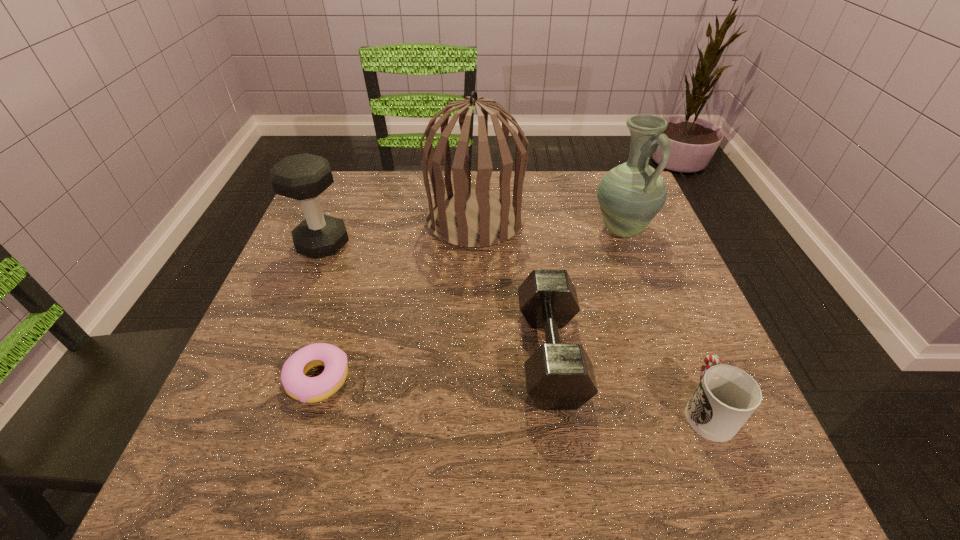
Locate an element on the screen. empty space that is in between the tallest object and the cup is located at coordinates (591, 314).

Identify the location of free space between the cup and the taller dumbbell. Image resolution: width=960 pixels, height=540 pixels. (515, 327).

The height and width of the screenshot is (540, 960). I want to click on free spot between the second tallest object and the shortest object, so click(469, 304).

The width and height of the screenshot is (960, 540). Find the location of `free space between the left dumbbell and the doughnut`. free space between the left dumbbell and the doughnut is located at coordinates (321, 312).

Where is `vacant area that lies between the shortest object and the fifth shortest object`? vacant area that lies between the shortest object and the fifth shortest object is located at coordinates (469, 304).

The image size is (960, 540). Find the location of `free space that is in between the tallest object and the shortest object`. free space that is in between the tallest object and the shortest object is located at coordinates click(x=396, y=300).

Identify the location of vacant point located between the doughnut and the cup. (513, 394).

Where is `vacant area that lies between the birdcage and the nearer dumbbell`? The width and height of the screenshot is (960, 540). vacant area that lies between the birdcage and the nearer dumbbell is located at coordinates (513, 287).

I want to click on vacant area between the cup and the pitcher, so click(664, 319).

Select which object is the closest to the cup. Please provide its 2D coordinates. Your answer should be formatted as a tuple, i.e. [(x, y)], where the tuple contains the x and y coordinates of a point satisfying the conditions above.

[(559, 376)]